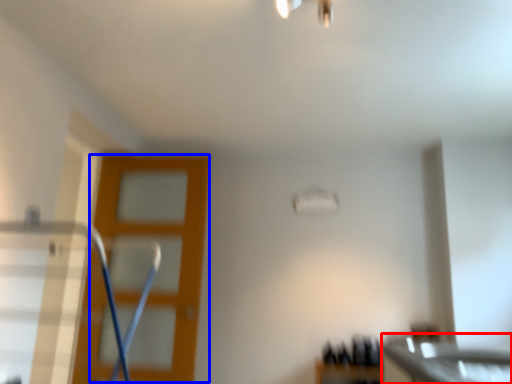
Question: Which of the following is the farthest to the observer, counter top (highlighted by a red box) or screen door (highlighted by a blue box)?

Choices:
 (A) counter top
 (B) screen door

Answer: (B)